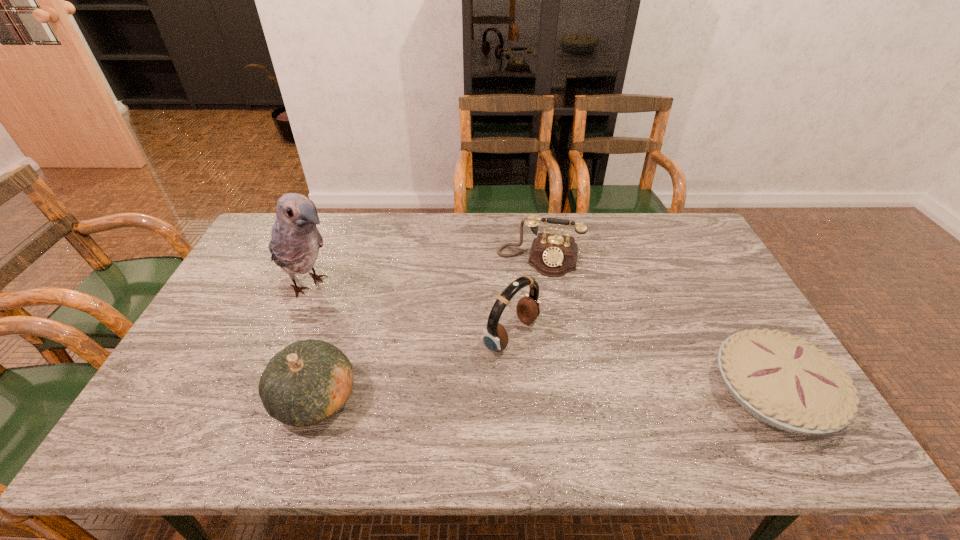
The height and width of the screenshot is (540, 960). I want to click on free space between the rightmost object and the headset, so click(642, 363).

You are a GUI agent. You are given a task and a screenshot of the screen. Output one action in this format:
    pyautogui.click(x=<x>, y=<y>)
    Task: Click on the free space between the headset and the parrot
    
    Given the screenshot: What is the action you would take?
    pyautogui.click(x=411, y=310)

I want to click on free space that is in between the shortest object and the gourd, so click(x=544, y=395).

At what (x,y) coordinates should I click in order to perform the action: click on free spot between the parrot and the shortest object. Please return your answer as a coordinate pair (x, y). This screenshot has height=540, width=960. Looking at the image, I should click on (541, 338).

Locate an element on the screen. The image size is (960, 540). free point between the telephone and the gourd is located at coordinates (427, 328).

The width and height of the screenshot is (960, 540). In order to click on vacant area that lies between the gourd and the telephone in this screenshot , I will do `click(427, 328)`.

Identify the location of object that is the fourth closest to the shortest object. The height and width of the screenshot is (540, 960). (295, 241).

Locate an element on the screen. This screenshot has width=960, height=540. object that can be found as the closest to the shortest object is located at coordinates (553, 255).

Locate an element on the screen. Image resolution: width=960 pixels, height=540 pixels. free region that satisfies the following two spatial constraints: 1. on the front side of the telephone; 2. on the left side of the rightmost object is located at coordinates (561, 392).

Identify the location of free space that satisfies the following two spatial constraints: 1. on the back side of the gourd; 2. on the left side of the pie. (318, 392).